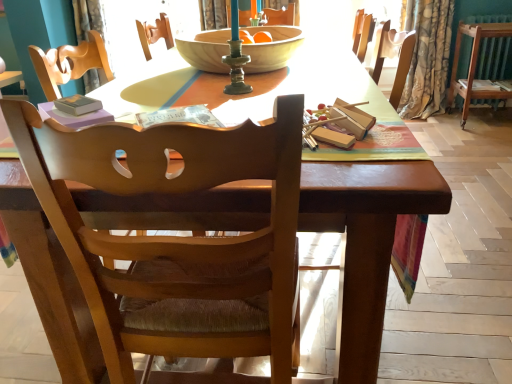
In order to click on free point in front of green metallic candle holder at center in this screenshot , I will do `click(239, 105)`.